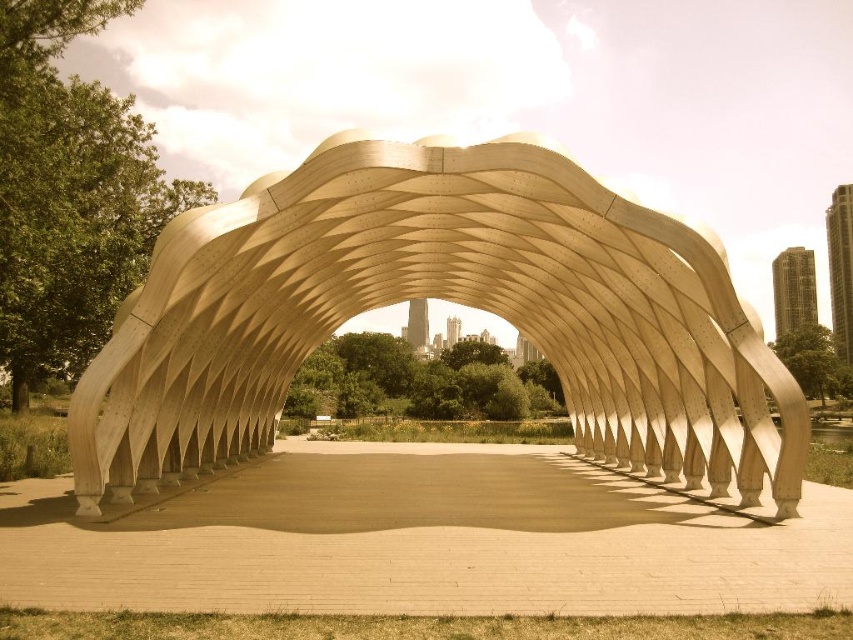
Question: Is smooth concrete path at center behind metallic glass skyscraper at upper right?

Choices:
 (A) yes
 (B) no

Answer: (B)

Question: From the image, what is the correct spatial relationship of smooth concrete path at center in relation to metallic glass skyscraper at upper right?

Choices:
 (A) above
 (B) below

Answer: (B)

Question: Which point is farther to the camera?

Choices:
 (A) (500, 266)
 (B) (808, 259)
 (C) (592, 529)

Answer: (B)

Question: Does smooth concrete path at center appear over metallic glass skyscraper at upper right?

Choices:
 (A) yes
 (B) no

Answer: (B)

Question: Which point is closer to the camera?

Choices:
 (A) (798, 326)
 (B) (564, 307)
 (C) (222, 532)

Answer: (C)

Question: Among these points, which one is farthest from the camera?

Choices:
 (A) (692, 317)
 (B) (801, 257)
 (C) (57, 586)

Answer: (B)